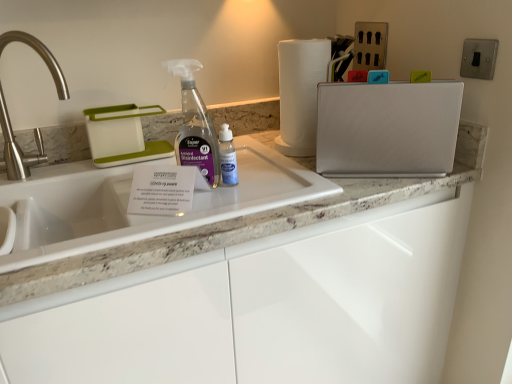
What do you see at coordinates (300, 93) in the screenshot? I see `white paper towel at upper right` at bounding box center [300, 93].

This screenshot has height=384, width=512. In order to click on brushed metal faucet at left in this screenshot , I will do `click(17, 148)`.

In order to face white plastic dish rack at upper left, which is counted as the second appliance, starting from the right, should I rotate leftwards or rightwards?

It's best to rotate left around 18.126 degrees.

Where is `white paper towel at upper right`? Image resolution: width=512 pixels, height=384 pixels. white paper towel at upper right is located at coordinates (300, 93).

Do you think brushed metal faucet at left is within metallic switch at upper right, or outside of it?

brushed metal faucet at left is spatially situated outside metallic switch at upper right.

Is brushed metal faucet at left smaller than metallic switch at upper right?

No.

Does brushed metal faucet at left touch metallic switch at upper right?

No, brushed metal faucet at left is not in contact with metallic switch at upper right.

From a real-world perspective, which is physically above, brushed metal faucet at left or metallic switch at upper right?

In real-world perspective, metallic switch at upper right is above.

How much distance is there between white paper towel at upper right and white marble countertop at center?

white paper towel at upper right is 25.35 centimeters away from white marble countertop at center.

Between white paper towel at upper right and white marble countertop at center, which one appears on the right side from the viewer's perspective?

From the viewer's perspective, white paper towel at upper right appears more on the right side.

Considering the sizes of objects white paper towel at upper right and white marble countertop at center in the image provided, who is wider, white paper towel at upper right or white marble countertop at center?

white marble countertop at center is wider.

Who is taller, white paper towel at upper right or white marble countertop at center?

With more height is white paper towel at upper right.

Is white plastic dish rack at upper left, the first appliance viewed from the left, surrounded by white marble countertop at center?

No, white marble countertop at center does not contain white plastic dish rack at upper left, the first appliance viewed from the left.

What's the angular difference between white marble countertop at center and white plastic dish rack at upper left, which is counted as the second appliance, starting from the right,'s facing directions?

They differ by 1.6 degrees in their facing directions.

How much distance is there between white marble countertop at center and white plastic dish rack at upper left, the first appliance viewed from the left?

white marble countertop at center and white plastic dish rack at upper left, the first appliance viewed from the left, are 17.75 inches apart.

In the image, is white marble countertop at center on the left side or the right side of white plastic dish rack at upper left, which is counted as the second appliance, starting from the right?

From the image, it's evident that white marble countertop at center is to the right of white plastic dish rack at upper left, which is counted as the second appliance, starting from the right.

Which is correct: white paper towel at upper right is inside white textured cutting board at upper right, positioned as the first appliance in right-to-left order, or outside of it?

white paper towel at upper right lies outside white textured cutting board at upper right, positioned as the first appliance in right-to-left order.

Is white paper towel at upper right to the left or to the right of white textured cutting board at upper right, which ranks as the 2th appliance in left-to-right order, in the image?

From the image, it's evident that white paper towel at upper right is to the left of white textured cutting board at upper right, which ranks as the 2th appliance in left-to-right order.

Does white paper towel at upper right turn towards white textured cutting board at upper right, which ranks as the 2th appliance in left-to-right order?

Yes, white paper towel at upper right is oriented towards white textured cutting board at upper right, which ranks as the 2th appliance in left-to-right order.

From the image's perspective, is white paper towel at upper right under white textured cutting board at upper right, positioned as the first appliance in right-to-left order?

Incorrect, from the image's perspective, white paper towel at upper right is higher than white textured cutting board at upper right, positioned as the first appliance in right-to-left order.

How many degrees apart are the facing directions of white marble countertop at center and brushed metal faucet at left?

The facing directions of white marble countertop at center and brushed metal faucet at left are 0.00137 degrees apart.

Is white marble countertop at center taller than brushed metal faucet at left?

No, white marble countertop at center is not taller than brushed metal faucet at left.

Is white marble countertop at center inside or outside of brushed metal faucet at left?

white marble countertop at center cannot be found inside brushed metal faucet at left.

Is point (280, 211) positioned in front of point (21, 158)?

Yes, it is.

Is point (490, 46) positioned in front of point (287, 103)?

Yes, point (490, 46) is closer to viewer.

Could white paper towel at upper right be considered to be inside metallic switch at upper right?

Actually, white paper towel at upper right is outside metallic switch at upper right.

From the image's perspective, which one is positioned lower, metallic switch at upper right or white paper towel at upper right?

white paper towel at upper right is shown below in the image.

Is white textured cutting board at upper right, positioned as the first appliance in right-to-left order, placed right next to metallic switch at upper right?

No, white textured cutting board at upper right, positioned as the first appliance in right-to-left order, is not beside metallic switch at upper right.

Which of these two, white textured cutting board at upper right, positioned as the first appliance in right-to-left order, or metallic switch at upper right, is thinner?

metallic switch at upper right.

From a real-world perspective, does white textured cutting board at upper right, which ranks as the 2th appliance in left-to-right order, stand above metallic switch at upper right?

Actually, white textured cutting board at upper right, which ranks as the 2th appliance in left-to-right order, is physically below metallic switch at upper right in the real world.

This screenshot has height=384, width=512. Find the location of `tap below the metallic switch at upper right (from a real-world perspective)`. tap below the metallic switch at upper right (from a real-world perspective) is located at coordinates (17, 148).

Where is `countertop in front of the white paper towel at upper right`? countertop in front of the white paper towel at upper right is located at coordinates (232, 230).

Estimate the real-world distances between objects in this image. Which object is further from metallic switch at upper right, white marble countertop at center or brushed metal faucet at left?

brushed metal faucet at left lies further to metallic switch at upper right than the other object.

Which object lies further to the anchor point white paper towel at upper right, metallic switch at upper right or white textured cutting board at upper right, positioned as the first appliance in right-to-left order?

metallic switch at upper right.

Considering their positions, is white plastic dish rack at upper left, which is counted as the second appliance, starting from the right, positioned closer to white paper towel at upper right than white textured cutting board at upper right, positioned as the first appliance in right-to-left order?

Among the two, white textured cutting board at upper right, positioned as the first appliance in right-to-left order, is located nearer to white paper towel at upper right.

From the image, which object appears to be farther from white marble countertop at center, white textured cutting board at upper right, which ranks as the 2th appliance in left-to-right order, or white plastic dish rack at upper left, the first appliance viewed from the left?

The object further to white marble countertop at center is white plastic dish rack at upper left, the first appliance viewed from the left.

Which object lies nearer to the anchor point white textured cutting board at upper right, positioned as the first appliance in right-to-left order, brushed metal faucet at left or white paper towel at upper right?

Among the two, white paper towel at upper right is located nearer to white textured cutting board at upper right, positioned as the first appliance in right-to-left order.

Estimate the real-world distances between objects in this image. Which object is further from white marble countertop at center, white paper towel at upper right or white textured cutting board at upper right, which ranks as the 2th appliance in left-to-right order?

white paper towel at upper right.

Which object lies nearer to the anchor point brushed metal faucet at left, white paper towel at upper right or white textured cutting board at upper right, positioned as the first appliance in right-to-left order?

Based on the image, white paper towel at upper right appears to be nearer to brushed metal faucet at left.

In the scene shown: When comparing their distances from white marble countertop at center, does white plastic dish rack at upper left, which is counted as the second appliance, starting from the right, or white paper towel at upper right seem further?

Among the two, white plastic dish rack at upper left, which is counted as the second appliance, starting from the right, is located further to white marble countertop at center.

Where is `countertop located between white plastic dish rack at upper left, the first appliance viewed from the left, and white paper towel at upper right in the left-right direction`? The image size is (512, 384). countertop located between white plastic dish rack at upper left, the first appliance viewed from the left, and white paper towel at upper right in the left-right direction is located at coordinates (232, 230).

The width and height of the screenshot is (512, 384). I want to click on toilet paper between brushed metal faucet at left and white textured cutting board at upper right, which ranks as the 2th appliance in left-to-right order, in the horizontal direction, so click(300, 93).

Locate an element on the screen. The image size is (512, 384). appliance between white paper towel at upper right and metallic switch at upper right in the horizontal direction is located at coordinates (388, 129).

You are a GUI agent. You are given a task and a screenshot of the screen. Output one action in this format:
    pyautogui.click(x=<x>, y=<y>)
    Task: Click on the countertop situated between brushed metal faucet at left and metallic switch at upper right from left to right
    Image resolution: width=512 pixels, height=384 pixels.
    Given the screenshot: What is the action you would take?
    pyautogui.click(x=232, y=230)